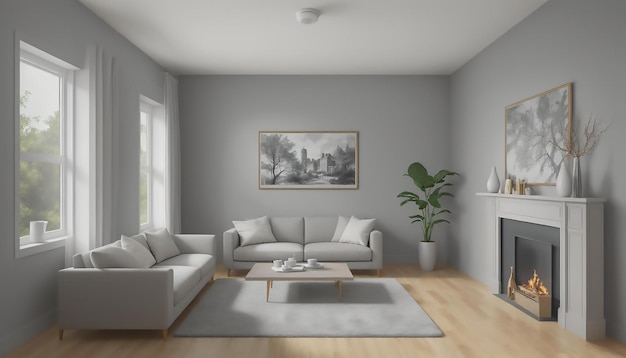
The height and width of the screenshot is (358, 626). Identify the location of fireplace. (525, 278).